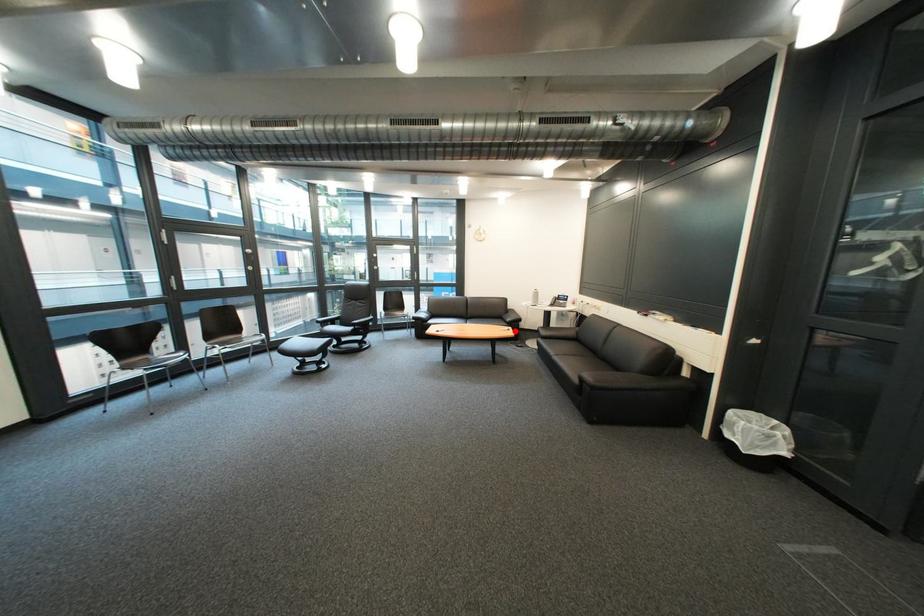
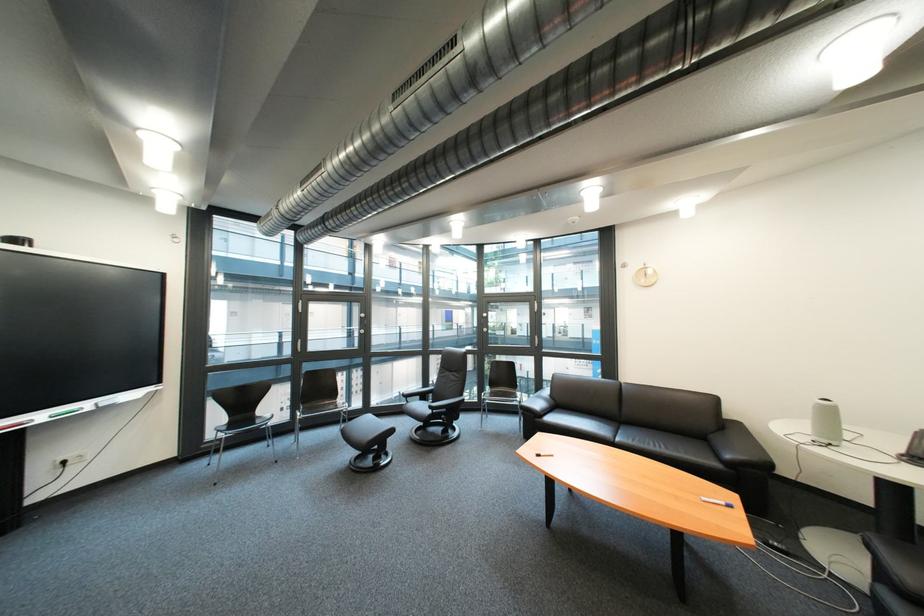
Question: I am providing you with two images of the same scene from different viewpoints. A red point is shown in image1. For the corresponding object point in image2, is it positioned nearer or farther from the camera?

Choices:
 (A) Nearer
 (B) Farther

Answer: (B)